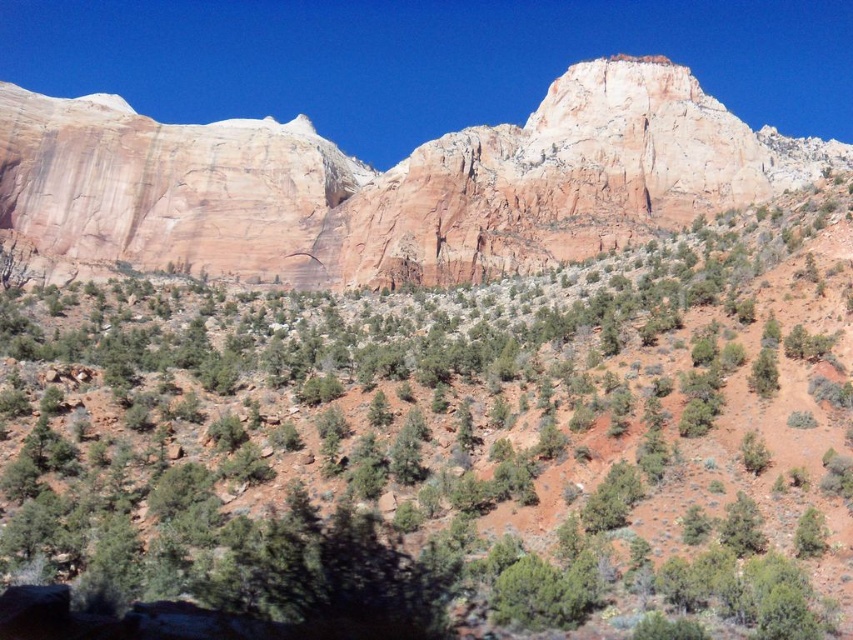
Which is above, green shrub at center or rustic sandstone mountain at upper center?

rustic sandstone mountain at upper center

Can you confirm if green shrub at center is thinner than rustic sandstone mountain at upper center?

Yes, green shrub at center is thinner than rustic sandstone mountain at upper center.

Where is `green shrub at center`? Image resolution: width=853 pixels, height=640 pixels. green shrub at center is located at coordinates (444, 448).